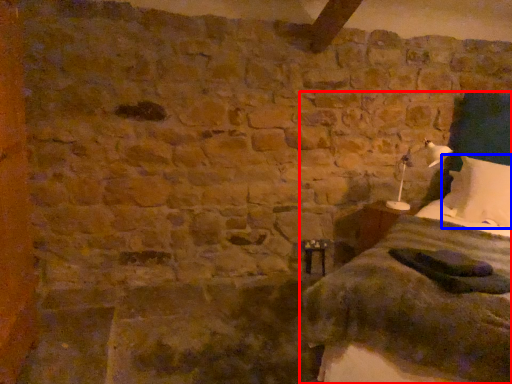
Question: Which point is further to the camera, bed (highlighted by a red box) or pillow (highlighted by a blue box)?

Choices:
 (A) bed
 (B) pillow

Answer: (B)